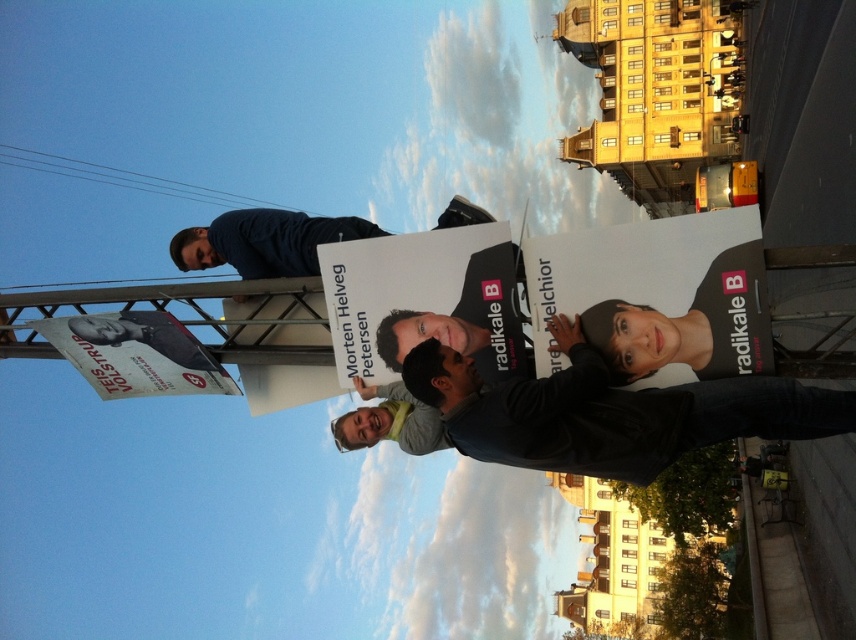
You are a photographer standing at the edge of the scene. You want to take a photo of the dark gray hoodie at center and the white paper poster at center. If your camera has a focal length of 50mm, which is suitable for portraits, will you need to adjust your position to ensure both subjects are in focus?

The dark gray hoodie at center is 4.41 meters away from the white paper poster at center. Since the distance between them is significant, you should adjust your position to ensure both are within the depth of field. A 50mm lens typically requires careful focus adjustment when subjects are at different distances to keep both sharp.

You are a photographer standing at point (542,408). You want to take a photo of the four people holding campaign posters for Radikale B. How far apart are the people from your current position?

The people are 40.97 meters away from your current position at point (542,408).